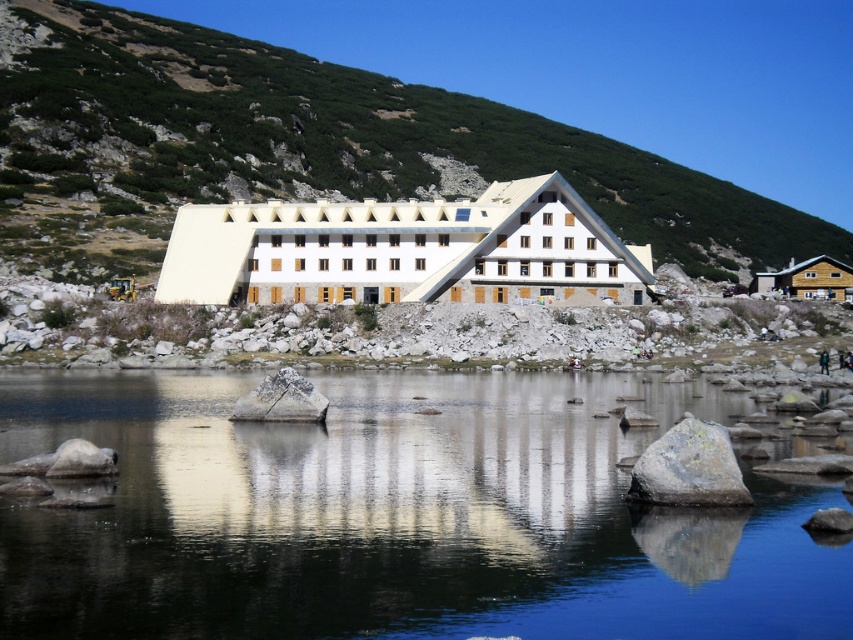
Question: Which object is farther from the camera taking this photo?

Choices:
 (A) smooth gray rock at lower right
 (B) white stone building at center
 (C) transparent water at center

Answer: (B)

Question: Which object is positioned closest to the smooth gray rock at lower right?

Choices:
 (A) white stone building at center
 (B) wooden cabin at right

Answer: (A)

Question: Can you confirm if transparent water at center is thinner than wooden cabin at right?

Choices:
 (A) no
 (B) yes

Answer: (A)

Question: Which point is farther from the camera taking this photo?

Choices:
 (A) (70, 442)
 (B) (849, 273)
 (C) (849, 524)
 (D) (552, 579)

Answer: (B)

Question: Considering the relative positions of white stone building at center and gray rough rock at center in the image provided, where is white stone building at center located with respect to gray rough rock at center?

Choices:
 (A) right
 (B) left

Answer: (B)

Question: Is green grassy hillside at center positioned in front of gray rock at center?

Choices:
 (A) no
 (B) yes

Answer: (A)